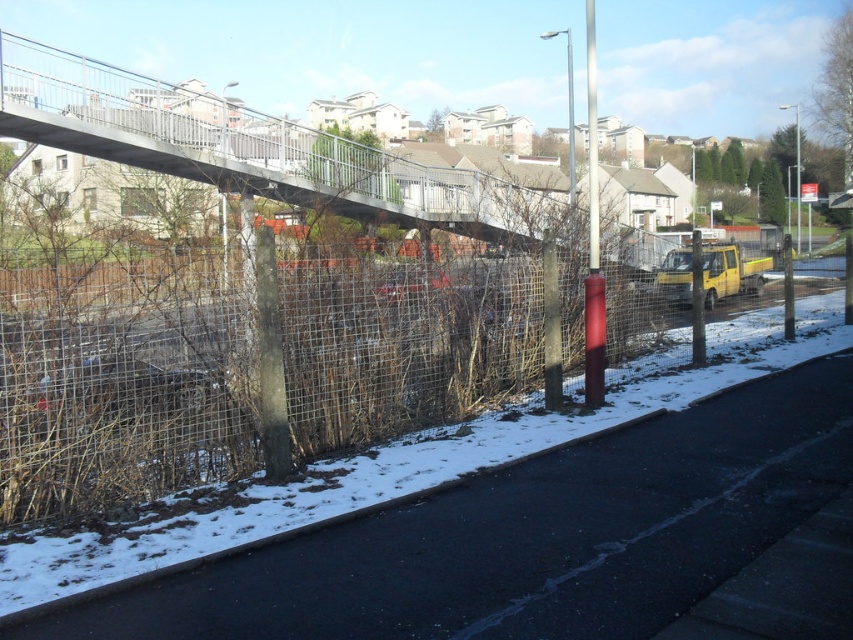
Question: Does smooth gray pole at center come in front of smooth red pole at center?

Choices:
 (A) yes
 (B) no

Answer: (A)

Question: Which object appears farthest from the camera in this image?

Choices:
 (A) smooth red pole at center
 (B) smooth gray pole at center

Answer: (A)

Question: Is wire mesh fence at lower left thinner than smooth gray pole at center?

Choices:
 (A) yes
 (B) no

Answer: (B)

Question: Which of these objects is positioned farthest from the wire mesh fence at lower left?

Choices:
 (A) smooth gray pole at center
 (B) smooth red pole at center

Answer: (B)

Question: From the image, what is the correct spatial relationship of wire mesh fence at lower left in relation to smooth red pole at center?

Choices:
 (A) above
 (B) below

Answer: (B)

Question: Which of the following is the closest to the observer?

Choices:
 (A) wire mesh fence at lower left
 (B) smooth gray pole at center
 (C) smooth red pole at center

Answer: (B)